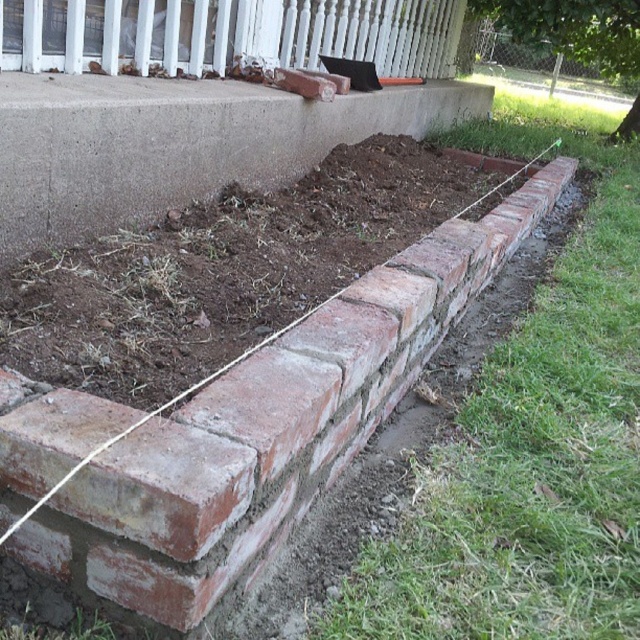
Between red brick wall at lower right and smooth white porch at upper center, which one is positioned higher?

Positioned higher is smooth white porch at upper center.

Which is in front, point (444, 314) or point (99, 28)?

Positioned in front is point (99, 28).

You are a GUI agent. You are given a task and a screenshot of the screen. Output one action in this format:
    pyautogui.click(x=<x>, y=<y>)
    Task: Click on the red brick wall at lower right
    
    Given the screenshot: What is the action you would take?
    pyautogui.click(x=241, y=433)